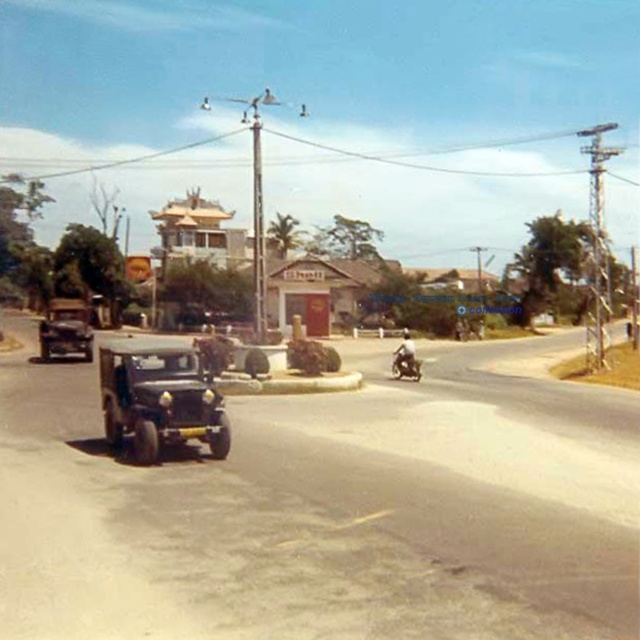
Can you confirm if shiny black car at center is taller than wooden temple at center?

No, shiny black car at center is not taller than wooden temple at center.

Who is more forward, (138, 394) or (234, 250)?

Positioned in front is point (138, 394).

Between point (113, 406) and point (221, 230), which one is positioned behind?

Positioned behind is point (221, 230).

Identify the location of shiny black car at center. Image resolution: width=640 pixels, height=640 pixels. (160, 397).

Can you confirm if shiny black car at left is smaller than shiny black motorcycle at center?

Incorrect, shiny black car at left is not smaller in size than shiny black motorcycle at center.

Does shiny black car at left appear under shiny black motorcycle at center?

No.

Find the location of a particular element. shiny black car at left is located at coordinates (65, 330).

You are a GUI agent. You are given a task and a screenshot of the screen. Output one action in this format:
    pyautogui.click(x=<x>, y=<y>)
    Task: Click on the shiny black car at left
    The height and width of the screenshot is (640, 640).
    Given the screenshot: What is the action you would take?
    pyautogui.click(x=65, y=330)

Between point (68, 330) and point (401, 349), which one is positioned in front?

Point (401, 349) is more forward.

Between shiny black car at left and metallic silver motorcycle at center, which one is positioned lower?

metallic silver motorcycle at center is below.

Measure the distance between point (48, 317) and camera.

The distance of point (48, 317) from camera is 37.21 meters.

Find the location of a particular element. shiny black car at left is located at coordinates (65, 330).